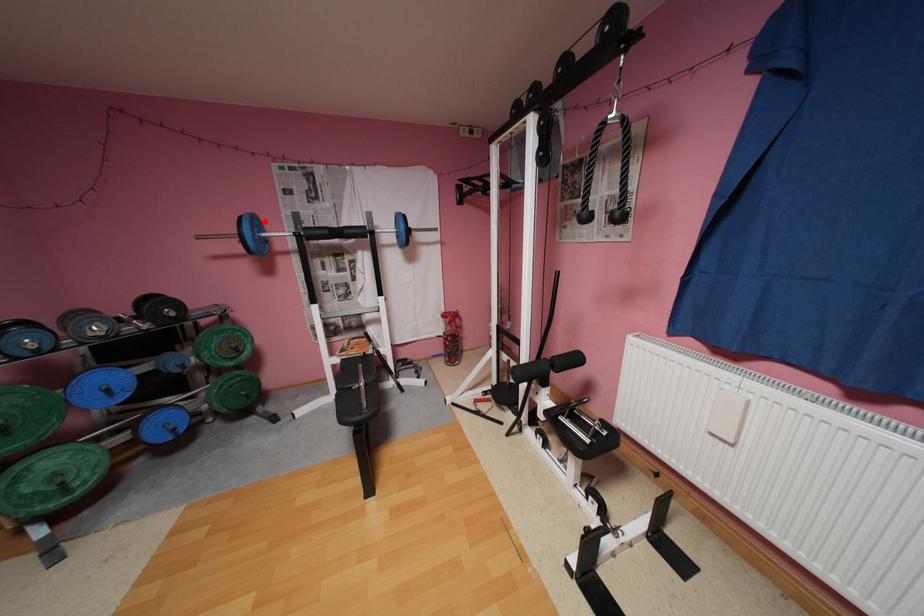
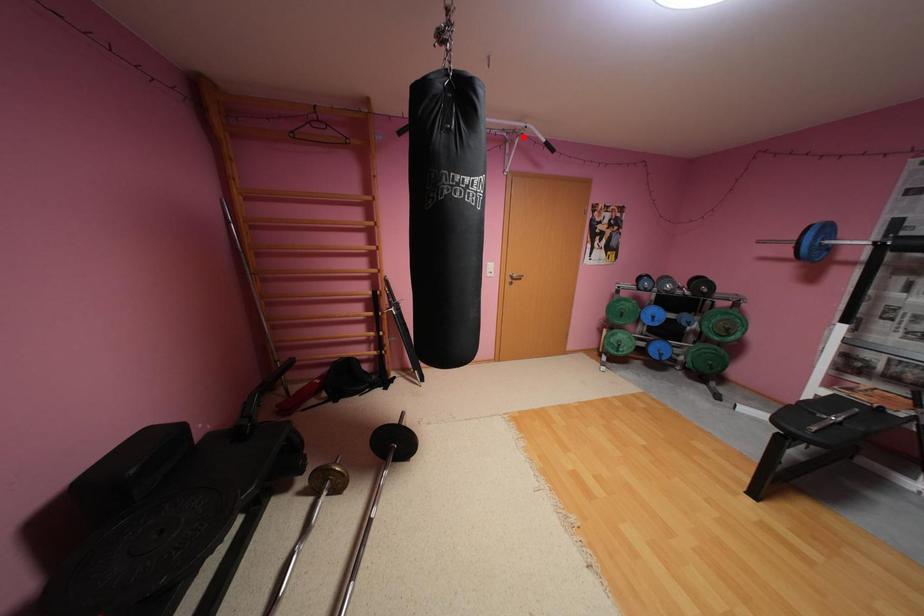
I am providing you with two images of the same scene from different viewpoints. A red point is marked on the first image and another point is marked on the second image. Do the highlighted points in image1 and image2 indicate the same real-world spot?

No